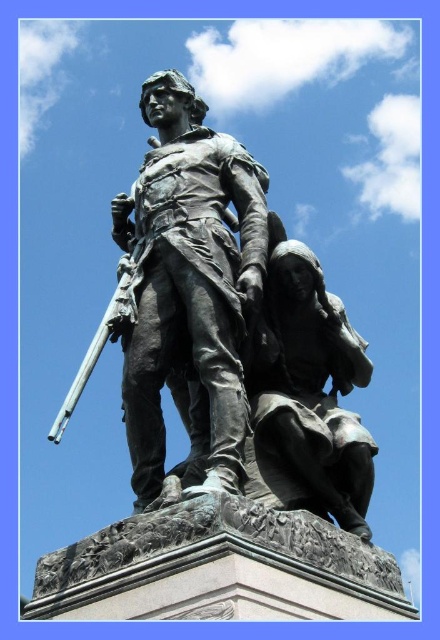
Question: Does bronze statue at center have a greater width compared to bronze statue at lower right?

Choices:
 (A) yes
 (B) no

Answer: (A)

Question: Does bronze statue at center appear on the left side of bronze statue at lower right?

Choices:
 (A) no
 (B) yes

Answer: (B)

Question: Is bronze statue at center bigger than bronze statue at lower right?

Choices:
 (A) yes
 (B) no

Answer: (A)